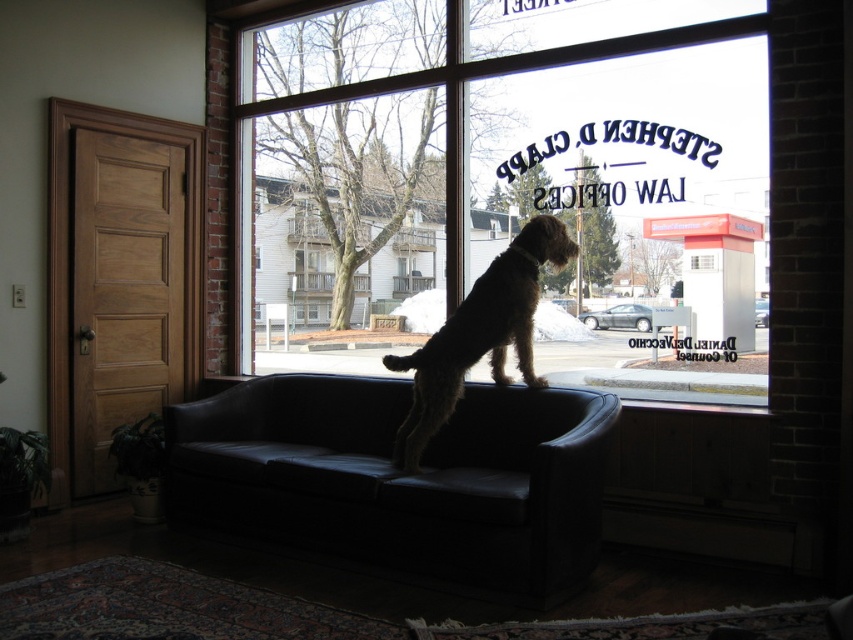
You are standing at the origin point of the image. The black leather couch at center is located at point (399, 477). If you want to move towards the black leather couch at center, in which direction should you move?

You should move towards the point (399, 477) to reach the black leather couch at center.

You are standing in the law office and want to see the view outside through the transparent glass window at center. To do this, should you move to the left or the right side of the black leather couch at center?

Since the transparent glass window at center is to the right of the black leather couch at center, you should move to the right side of the black leather couch at center to see the view outside through the transparent glass window at center.